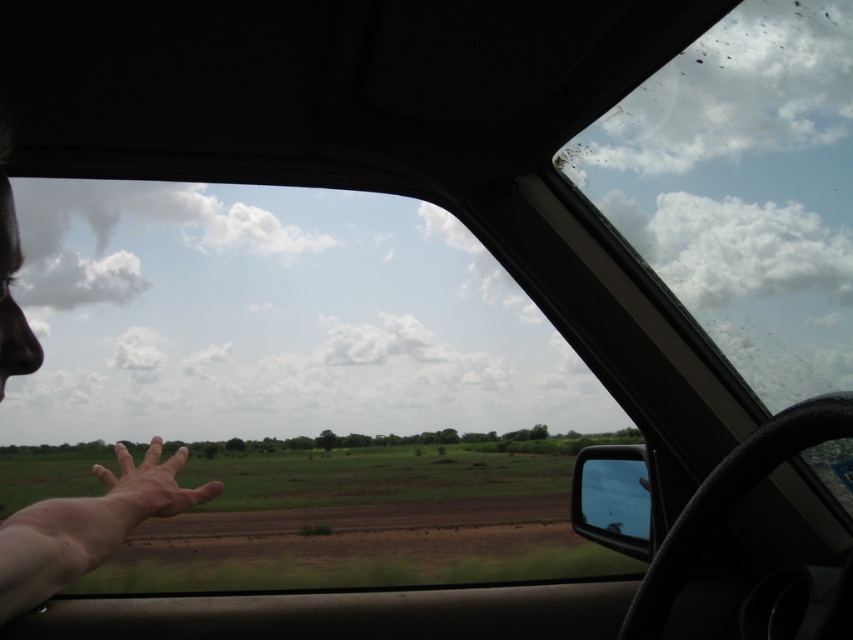
Where is `transparent glass windshield at upper right`? The image size is (853, 640). transparent glass windshield at upper right is located at coordinates (743, 188).

Is transparent glass windshield at upper right bigger than skinny flesh hand at lower left?

Yes.

In order to click on transparent glass windshield at upper right in this screenshot , I will do (x=743, y=188).